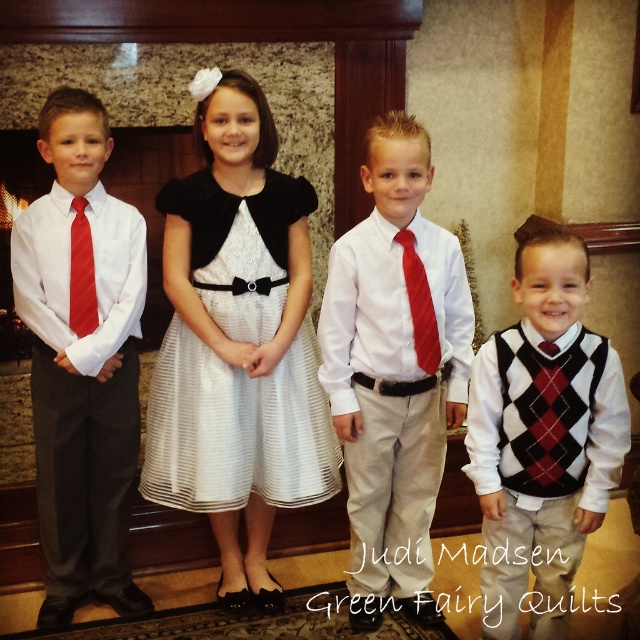
Question: In this image, where is white satin dress at center located relative to red satin tie at left?

Choices:
 (A) below
 (B) above

Answer: (A)

Question: Does matte white shirt at left come in front of white satin dress at center?

Choices:
 (A) yes
 (B) no

Answer: (A)

Question: Among these objects, which one is nearest to the camera?

Choices:
 (A) argyle sweater vest at center
 (B) matte white shirt at left

Answer: (A)

Question: Among these points, which one is nearest to the camera?

Choices:
 (A) (x=552, y=422)
 (B) (x=429, y=314)
 (C) (x=316, y=349)

Answer: (A)

Question: Among these objects, which one is farthest from the camera?

Choices:
 (A) matte red tie at center
 (B) argyle sweater vest at center
 (C) red satin tie at center
 (D) white satin dress at center

Answer: (D)

Question: Can you confirm if red satin tie at center is positioned to the left of red satin tie at left?

Choices:
 (A) yes
 (B) no

Answer: (B)